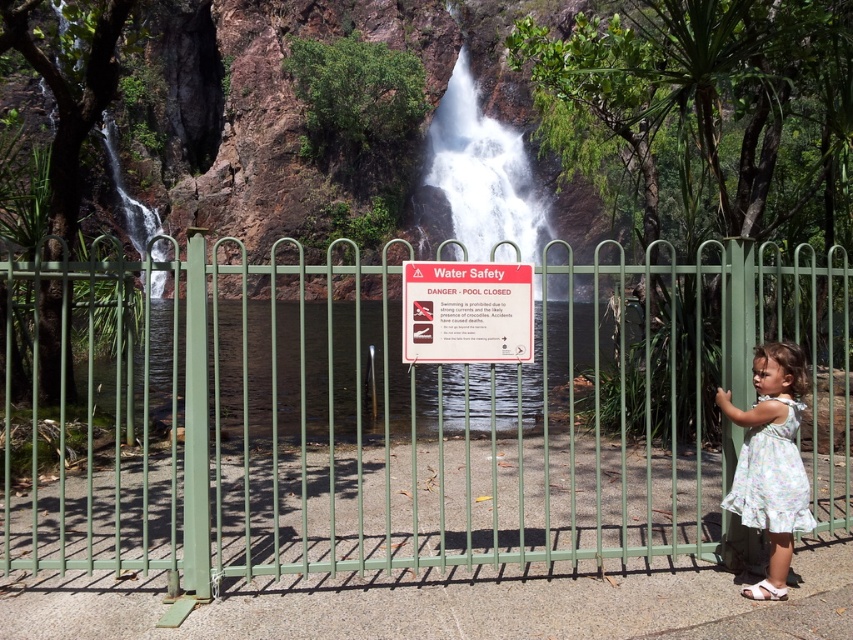
Does white frothy water at center have a smaller size compared to floral dress at center?

No.

Is point (476, 90) positioned behind point (776, 376)?

Yes, it is.

Where is `white frothy water at center`? white frothy water at center is located at coordinates (482, 173).

Does green metal fence at center have a greater height compared to floral cotton dress at right?

Indeed, green metal fence at center has a greater height compared to floral cotton dress at right.

Does green metal fence at center have a larger size compared to floral cotton dress at right?

Correct, green metal fence at center is larger in size than floral cotton dress at right.

Locate an element on the screen. green metal fence at center is located at coordinates (399, 419).

Who is more forward, (780,516) or (782,444)?

Positioned in front is point (780,516).

Image resolution: width=853 pixels, height=640 pixels. Describe the element at coordinates (770, 461) in the screenshot. I see `floral dress at center` at that location.

The width and height of the screenshot is (853, 640). I want to click on floral dress at center, so click(x=770, y=461).